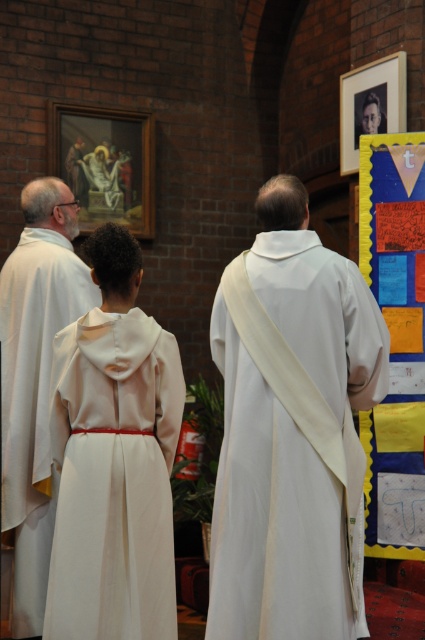
Question: Which object is the closest to the white matte robe at left?

Choices:
 (A) white clothed man at center
 (B) white matte dress at center

Answer: (B)

Question: Which object is the closest to the white clothed man at center?

Choices:
 (A) white matte robe at left
 (B) white matte dress at center

Answer: (B)

Question: Is white matte dress at center bigger than white matte robe at left?

Choices:
 (A) yes
 (B) no

Answer: (B)

Question: Does white matte dress at center lie behind white matte robe at left?

Choices:
 (A) yes
 (B) no

Answer: (B)

Question: Is white clothed man at center to the left of white matte dress at center from the viewer's perspective?

Choices:
 (A) no
 (B) yes

Answer: (A)

Question: Considering the real-world distances, which object is farthest from the white clothed man at center?

Choices:
 (A) white matte robe at left
 (B) white matte dress at center

Answer: (A)